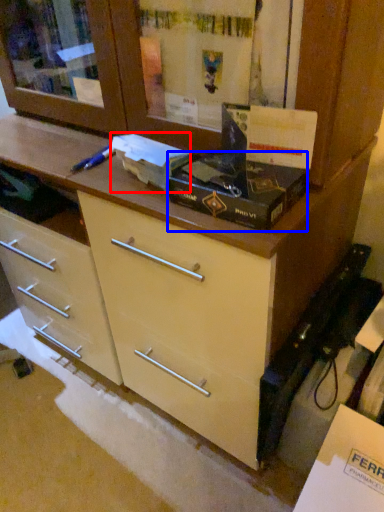
Question: Among these objects, which one is farthest to the camera, box (highlighted by a red box) or box (highlighted by a blue box)?

Choices:
 (A) box
 (B) box

Answer: (A)